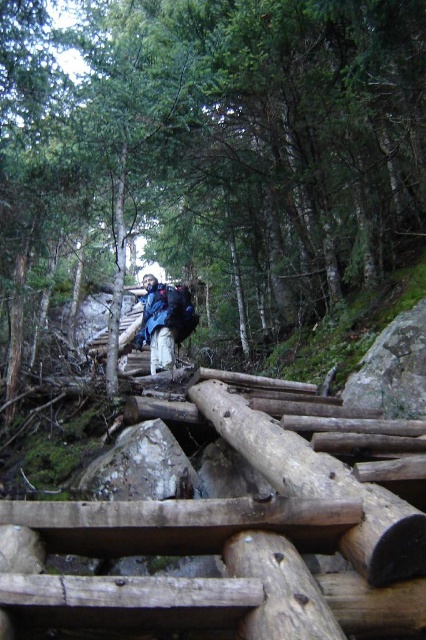
Question: Is green matte tree at center behind blue fabric backpack at center?

Choices:
 (A) yes
 (B) no

Answer: (B)

Question: Can you confirm if green matte tree at center is positioned above blue fabric backpack at center?

Choices:
 (A) yes
 (B) no

Answer: (A)

Question: Among these objects, which one is farthest from the camera?

Choices:
 (A) blue fabric backpack at center
 (B) green matte tree at center

Answer: (A)

Question: Can you confirm if green matte tree at center is positioned above blue fabric backpack at center?

Choices:
 (A) no
 (B) yes

Answer: (B)

Question: Among these objects, which one is farthest from the camera?

Choices:
 (A) green matte tree at center
 (B) blue fabric backpack at center

Answer: (B)